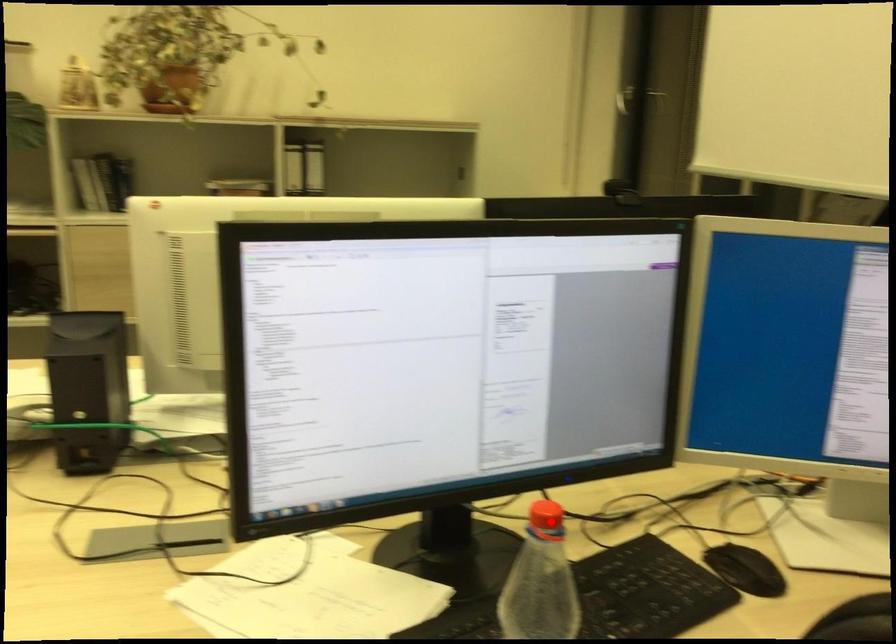
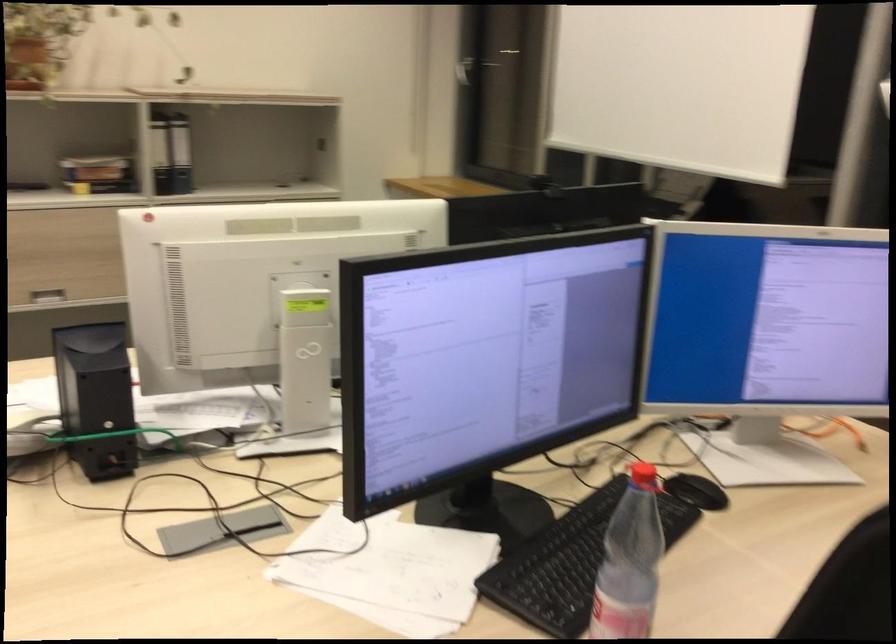
Question: I am providing you with two images of the same scene from different viewpoints. A red point is shown in image1. For the corresponding object point in image2, is it positioned nearer or farther from the camera?

Choices:
 (A) Nearer
 (B) Farther

Answer: (B)